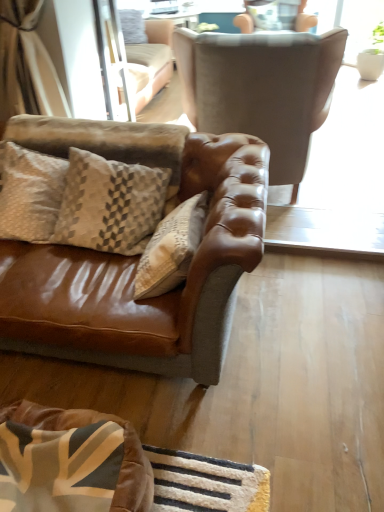
Question: Is point [x=221, y=93] closer or farther from the camera than point [x=258, y=10]?

Choices:
 (A) farther
 (B) closer

Answer: (B)

Question: Considering their positions, is suede brown armchair at upper center, arranged as the 1th chair when viewed from the front, located in front of or behind suede-like beige armchair at upper center, acting as the 2th chair starting from the bottom?

Choices:
 (A) front
 (B) behind

Answer: (A)

Question: Estimate the real-world distances between objects in this image. Which object is farther from the velvet brown dog bed at lower left?

Choices:
 (A) suede brown armchair at upper center, which appears as the second chair when viewed from the top
 (B) suede-like beige armchair at upper center, the second chair from the front
 (C) beige textured pillow at left
 (D) clear glass screen door at upper center

Answer: (B)

Question: Based on their relative distances, which object is farther from the suede-like beige armchair at upper center, acting as the 2th chair starting from the bottom?

Choices:
 (A) clear glass screen door at upper center
 (B) velvet brown dog bed at lower left
 (C) suede brown armchair at upper center, marked as the second chair in a back-to-front arrangement
 (D) beige textured pillow at left

Answer: (B)